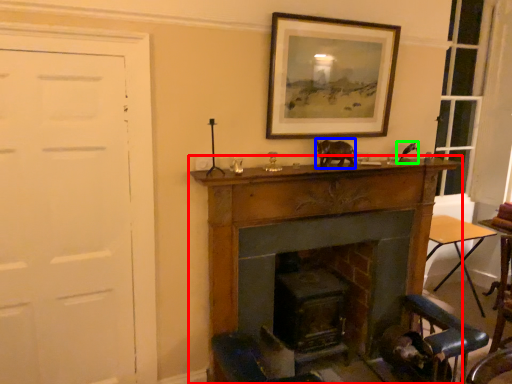
Question: Which is farther away from fireplace (highlighted by a red box)? animal (highlighted by a blue box) or animal (highlighted by a green box)?

Choices:
 (A) animal
 (B) animal

Answer: (B)